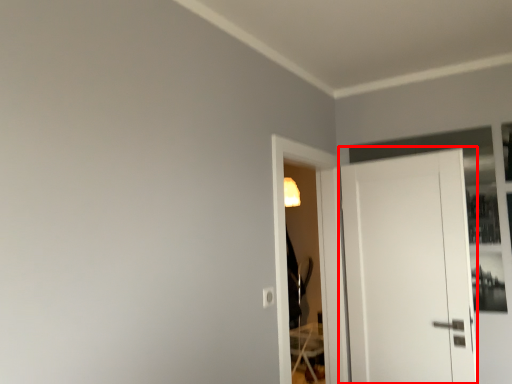
Question: Where is door (annotated by the red box) located in relation to screen door in the image?

Choices:
 (A) right
 (B) left

Answer: (A)